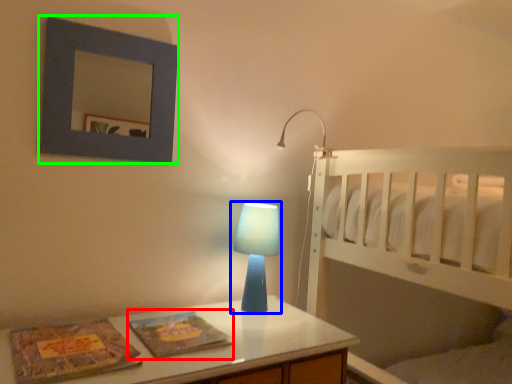
Question: Which object is positioned farthest from magazine (highlighted by a red box)? Select from lamp (highlighted by a blue box) and picture frame (highlighted by a green box).

Choices:
 (A) lamp
 (B) picture frame

Answer: (B)